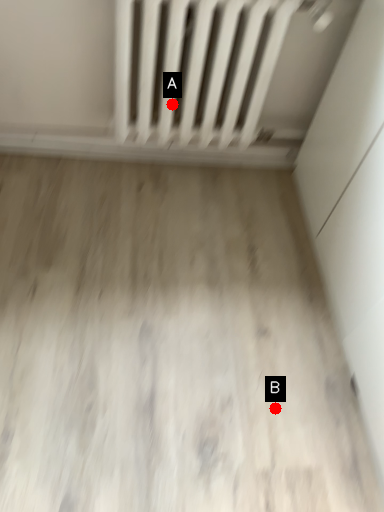
Question: Two points are circled on the image, labeled by A and B beside each circle. Which point appears farthest from the camera in this image?

Choices:
 (A) A is further
 (B) B is further

Answer: (A)